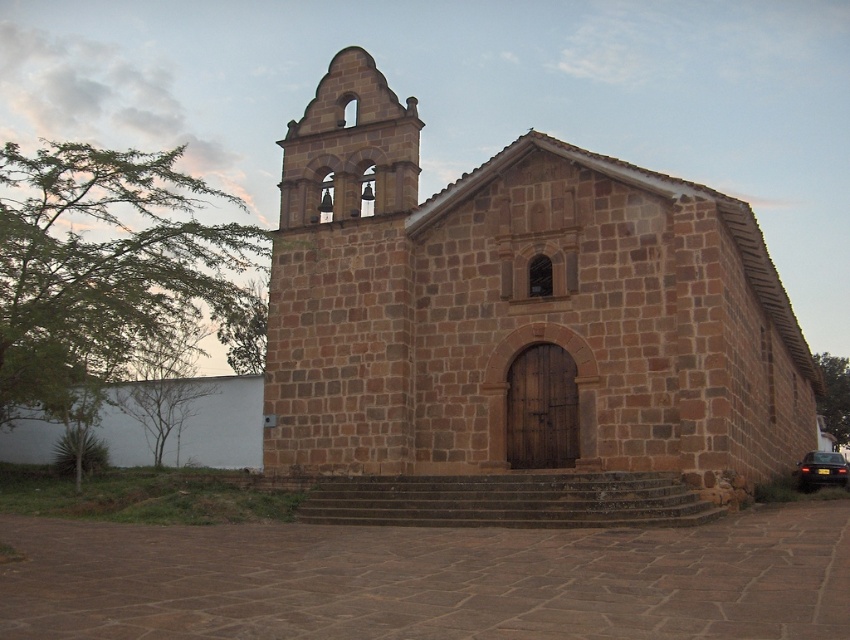
Question: Does brown stone church at center appear on the left side of brown stone bell tower at upper left?

Choices:
 (A) yes
 (B) no

Answer: (B)

Question: Which point is farther to the camera?

Choices:
 (A) (350, 92)
 (B) (435, 401)

Answer: (A)

Question: Does brown stone church at center have a greater width compared to brown stone bell tower at upper left?

Choices:
 (A) yes
 (B) no

Answer: (A)

Question: Is brown stone church at center to the right of brown stone bell tower at upper left from the viewer's perspective?

Choices:
 (A) yes
 (B) no

Answer: (A)

Question: Which object appears closest to the camera in this image?

Choices:
 (A) brown stone church at center
 (B) brown stone bell tower at upper left

Answer: (A)